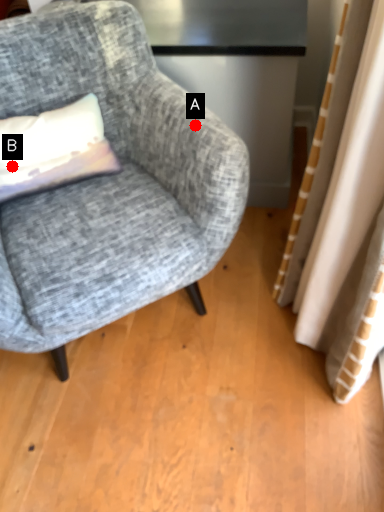
Question: Two points are circled on the image, labeled by A and B beside each circle. Which point is farther to the camera?

Choices:
 (A) A is further
 (B) B is further

Answer: (B)